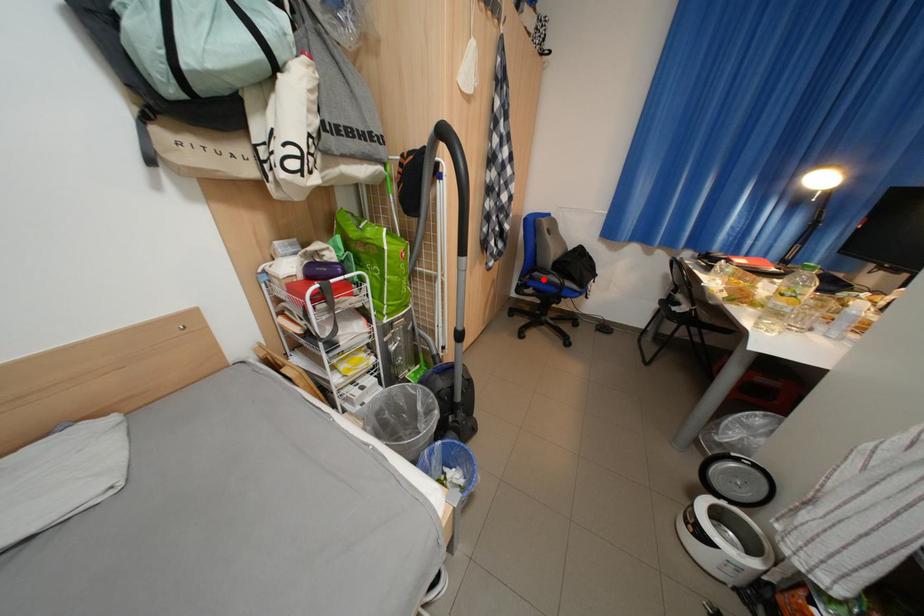
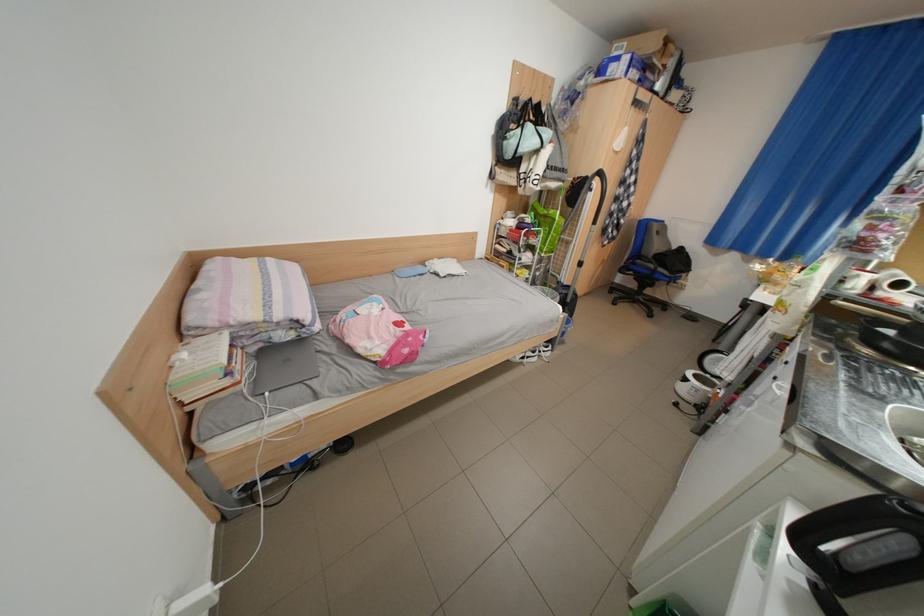
Question: I am providing you with two images of the same scene from different viewpoints. Image1 has a red point marked. In image2, the corresponding 3D location appears at what relative position? Reply with the corresponding letter.

Choices:
 (A) Closer
 (B) Farther

Answer: (A)